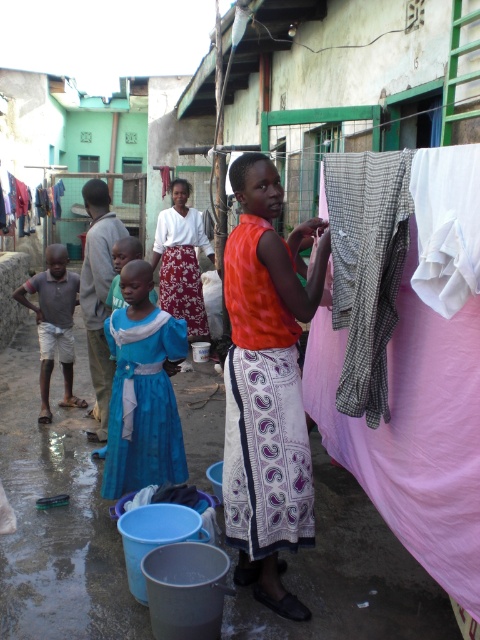
You are a photographer trying to capture a shot of the matte blue dress at center and the pink fabric clothesline at center. Which object should you focus on first if you want to photograph both in a single frame without moving the camera?

The matte blue dress at center is taller than the pink fabric clothesline at center, so you should focus on the matte blue dress at center first to ensure its full height is captured in the frame.

You are a photographer trying to capture the matte blue dress at center and the white printed fabric dress at center. Which dress is closer to the camera?

The matte blue dress at center is positioned under the white printed fabric dress at center, so the white printed fabric dress at center is closer to the camera.